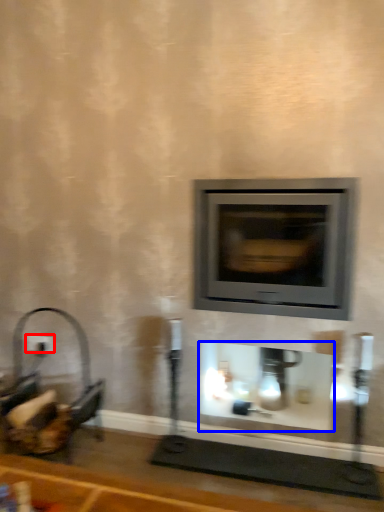
Question: Which object is closer to the camera taking this photo, electric outlet (highlighted by a red box) or fireplace (highlighted by a blue box)?

Choices:
 (A) electric outlet
 (B) fireplace

Answer: (B)